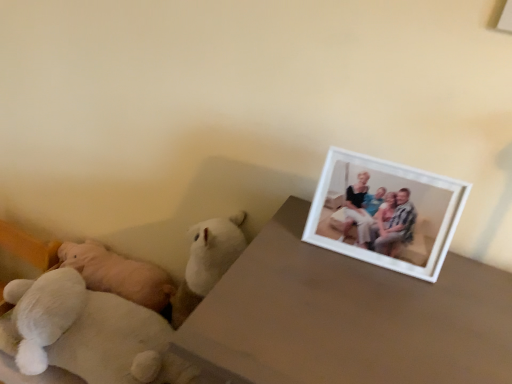
Question: Is point (245, 258) positioned closer to the camera than point (412, 173)?

Choices:
 (A) farther
 (B) closer

Answer: (B)

Question: Considering the relative positions of white matte table at upper right and white matte picture frame at upper right in the image provided, is white matte table at upper right to the left or to the right of white matte picture frame at upper right?

Choices:
 (A) left
 (B) right

Answer: (A)

Question: Estimate the real-world distances between objects in this image. Which object is closer to the white plush teddy bear at lower left, which is the 2th teddy bear in left-to-right order?

Choices:
 (A) white plush teddy bear at left, the 2th teddy bear positioned from the front
 (B) white matte table at upper right
 (C) white matte picture frame at upper right

Answer: (A)

Question: Considering the real-world distances, which object is farthest from the white matte picture frame at upper right?

Choices:
 (A) white plush teddy bear at left, which ranks as the 1th teddy bear in left-to-right order
 (B) white matte table at upper right
 (C) white plush teddy bear at lower left, the second teddy bear positioned from the back

Answer: (A)